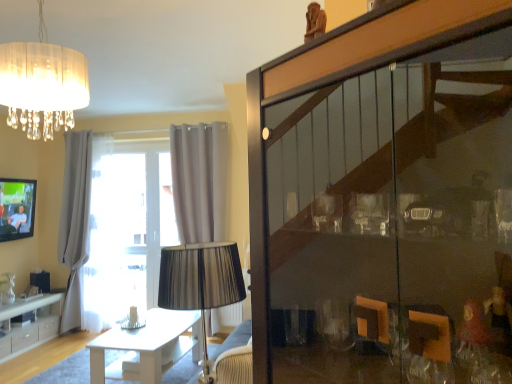
Question: From the image's perspective, does white glossy table at center appear lower than translucent fabric chandelier at upper left?

Choices:
 (A) no
 (B) yes

Answer: (B)

Question: Is white glossy table at center smaller than translucent fabric chandelier at upper left?

Choices:
 (A) no
 (B) yes

Answer: (A)

Question: Is white glossy table at center directly adjacent to translucent fabric chandelier at upper left?

Choices:
 (A) no
 (B) yes

Answer: (A)

Question: From a real-world perspective, is white glossy table at center beneath translucent fabric chandelier at upper left?

Choices:
 (A) no
 (B) yes

Answer: (B)

Question: Is white glossy table at center not inside translucent fabric chandelier at upper left?

Choices:
 (A) no
 (B) yes

Answer: (B)

Question: Can you confirm if white glossy table at center is positioned to the right of translucent fabric chandelier at upper left?

Choices:
 (A) no
 (B) yes

Answer: (B)

Question: Can you confirm if translucent fabric chandelier at upper left is smaller than white glossy cabinet at lower left?

Choices:
 (A) no
 (B) yes

Answer: (B)

Question: Can you confirm if translucent fabric chandelier at upper left is shorter than white glossy cabinet at lower left?

Choices:
 (A) yes
 (B) no

Answer: (B)

Question: Can you confirm if translucent fabric chandelier at upper left is taller than white glossy cabinet at lower left?

Choices:
 (A) no
 (B) yes

Answer: (B)

Question: Considering the relative sizes of translucent fabric chandelier at upper left and white glossy cabinet at lower left in the image provided, is translucent fabric chandelier at upper left thinner than white glossy cabinet at lower left?

Choices:
 (A) no
 (B) yes

Answer: (A)

Question: Is translucent fabric chandelier at upper left facing towards white glossy cabinet at lower left?

Choices:
 (A) yes
 (B) no

Answer: (B)

Question: From the image's perspective, would you say translucent fabric chandelier at upper left is shown under white glossy cabinet at lower left?

Choices:
 (A) yes
 (B) no

Answer: (B)

Question: Is matte black tv at left positioned beyond the bounds of white sheer curtain at left, the 1th curtain in the left-to-right sequence?

Choices:
 (A) yes
 (B) no

Answer: (A)